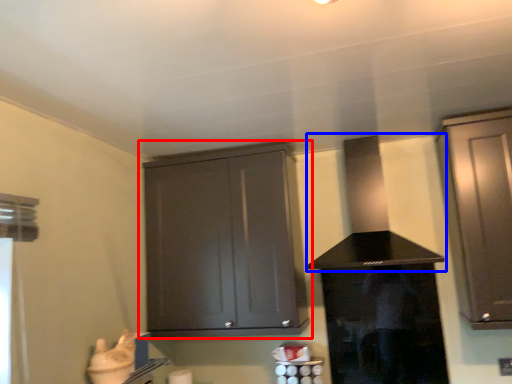
Question: Which object appears closest to the camera in this image, cabinetry (highlighted by a red box) or vent (highlighted by a blue box)?

Choices:
 (A) cabinetry
 (B) vent

Answer: (B)